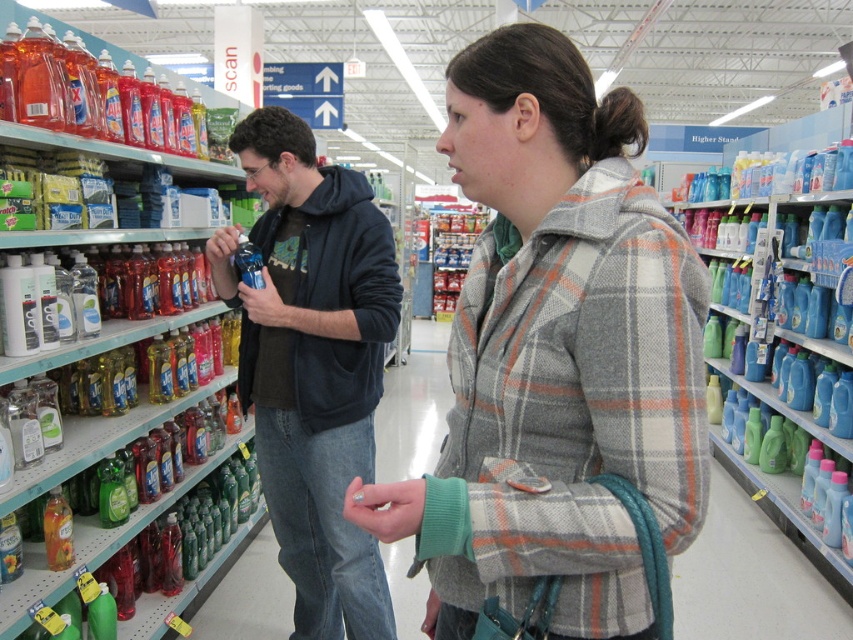
You are a store employee who needs to restock the cleaning products on the left shelf. You are currently standing at the point marked by the coordinates point (555, 356). Can you reach the left shelf from your current position without moving your feet?

The point (555, 356) corresponds to the plaid woolen jacket at center. Since the left shelf is on the opposite side of the store from the plaid woolen jacket at center, you cannot reach it without moving your feet.

You are a store employee who needs to place a 36 inch wide box between the plaid woolen jacket at center and the dark blue hoodie at center. Can the box fit between them without overlapping either garment?

The plaid woolen jacket at center and dark blue hoodie at center are 37.27 inches apart from each other. Since the box is 36 inches wide, it can fit between them without overlapping either garment.

You are a store employee who needs to reach a product on the top shelf of the cleaning products section. You are standing 32.24 inches away from the plaid woolen jacket at center. If the top shelf is 6 feet high, can you safely reach it?

The plaid woolen jacket at center and viewer are 32.24 inches apart, so you are close enough to safely reach the top shelf which is 6 feet high.